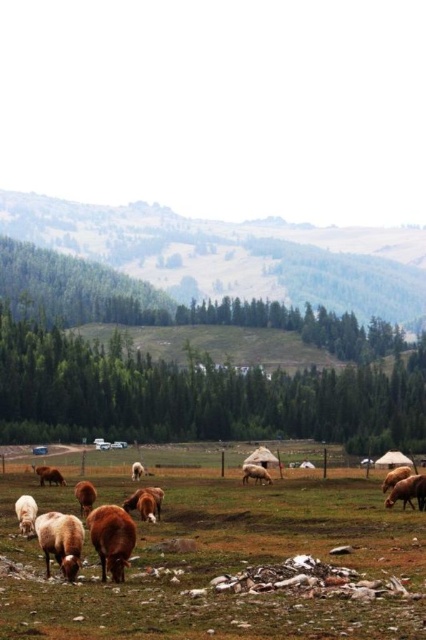
Does point (108, 525) come in front of point (28, 515)?

Yes, point (108, 525) is closer to viewer.

Who is positioned more to the right, brown furry cow at center or white woolly sheep at lower left?

brown furry cow at center is more to the right.

Is point (126, 547) farther from viewer compared to point (28, 504)?

That is False.

The height and width of the screenshot is (640, 426). I want to click on brown furry cow at center, so click(112, 538).

Does fuzzy brown sheep at lower left have a greater height compared to brown woolly sheep at center?

Yes, fuzzy brown sheep at lower left is taller than brown woolly sheep at center.

Identify the location of fuzzy brown sheep at lower left. This screenshot has width=426, height=640. (60, 541).

What do you see at coordinates (60, 541) in the screenshot? This screenshot has height=640, width=426. I see `fuzzy brown sheep at lower left` at bounding box center [60, 541].

This screenshot has width=426, height=640. I want to click on fuzzy brown sheep at lower left, so click(60, 541).

Is brown furry cow at center bigger than fuzzy brown sheep at lower left?

Yes.

Does brown furry cow at center lie in front of fuzzy brown sheep at lower left?

No, brown furry cow at center is further to the viewer.

Between point (104, 515) and point (78, 552), which one is positioned in front?

Point (78, 552)

Where is `brown furry cow at center`? This screenshot has width=426, height=640. brown furry cow at center is located at coordinates (112, 538).